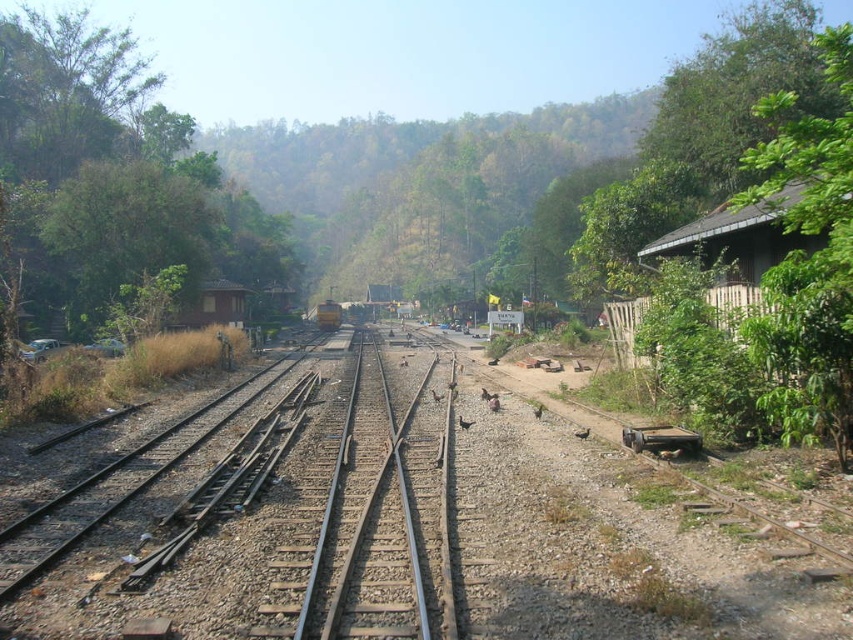
The height and width of the screenshot is (640, 853). Identify the location of metal/rough track at center. (299, 518).

Is metal/rough track at center further to camera compared to brown feathered bird at center?

No, it is in front of brown feathered bird at center.

Where is `metal/rough track at center`? This screenshot has width=853, height=640. metal/rough track at center is located at coordinates (299, 518).